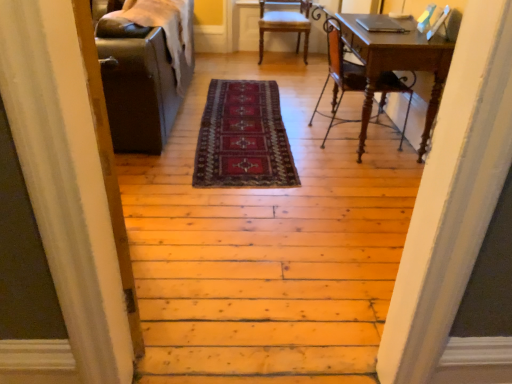
What is the approximate height of wooden chair at right, placed as the second chair when sorted from back to front?

36.46 inches.

The height and width of the screenshot is (384, 512). Identify the location of wooden chair at right, which is the 1th chair from front to back. (339, 71).

Image resolution: width=512 pixels, height=384 pixels. I want to click on wooden desk at right, so click(397, 64).

Measure the distance between point (258, 172) and camera.

Point (258, 172) and camera are 2.66 meters apart.

What are the coordinates of `wooden chair at right, which is the 1th chair from front to back` in the screenshot? It's located at (339, 71).

Could you measure the distance between wooden chair at center, arranged as the 1th chair when viewed from the back, and wooden chair at right, the 1th chair positioned from the bottom?

1.63 meters.

Is wooden chair at center, the first chair in the top-to-bottom sequence, aimed at wooden chair at right, which is the 1th chair from front to back?

Yes, wooden chair at center, the first chair in the top-to-bottom sequence, is facing wooden chair at right, which is the 1th chair from front to back.

Considering the relative positions of wooden chair at center, the second chair when ordered from front to back, and wooden chair at right, which is the 1th chair from front to back, in the image provided, is wooden chair at center, the second chair when ordered from front to back, to the left of wooden chair at right, which is the 1th chair from front to back, from the viewer's perspective?

Yes.

Find the location of a particular element. The width and height of the screenshot is (512, 384). chair that appears below the wooden chair at center, the second chair when ordered from front to back (from the image's perspective) is located at coordinates (339, 71).

Which object is thinner, wooden chair at right, the second chair from the top, or wooden floor at center?

With smaller width is wooden chair at right, the second chair from the top.

Does wooden chair at right, placed as the second chair when sorted from back to front, have a lesser height compared to wooden floor at center?

No.

Is wooden chair at right, which is the 1th chair from front to back, facing towards wooden floor at center?

No.

Between wooden chair at right, the second chair from the top, and wooden desk at right, which one has larger width?

wooden chair at right, the second chair from the top, is wider.

From a real-world perspective, is wooden chair at right, the second chair from the top, positioned over wooden desk at right based on gravity?

Yes, from a real-world perspective, wooden chair at right, the second chair from the top, is above wooden desk at right.

Considering the positions of point (391, 77) and point (428, 138), is point (391, 77) closer or farther from the camera than point (428, 138)?

Point (391, 77) is positioned closer to the camera compared to point (428, 138).

What are the coordinates of `chair that is the 1st one when counting backward from the wooden desk at right` in the screenshot? It's located at (339, 71).

How different are the orientations of wooden chair at center, the second chair when ordered from front to back, and dark red woven rug at center in degrees?

The facing directions of wooden chair at center, the second chair when ordered from front to back, and dark red woven rug at center are 1.57 degrees apart.

Is point (298, 12) positioned before point (249, 89)?

No.

Could you measure the distance between wooden chair at center, arranged as the 1th chair when viewed from the back, and dark red woven rug at center?

wooden chair at center, arranged as the 1th chair when viewed from the back, is 1.90 meters from dark red woven rug at center.

Is wooden chair at center, arranged as the 1th chair when viewed from the back, oriented away from dark red woven rug at center?

No, dark red woven rug at center is not at the back of wooden chair at center, arranged as the 1th chair when viewed from the back.

Considering the sizes of dark red woven rug at center and wooden floor at center in the image, is dark red woven rug at center taller or shorter than wooden floor at center?

In the image, dark red woven rug at center appears to be shorter than wooden floor at center.

The image size is (512, 384). I want to click on stairwell below the dark red woven rug at center (from a real-world perspective), so click(x=268, y=251).

Considering the sizes of objects dark red woven rug at center and wooden floor at center in the image provided, who is bigger, dark red woven rug at center or wooden floor at center?

With larger size is wooden floor at center.

Is dark red woven rug at center looking in the opposite direction of wooden floor at center?

Absolutely, dark red woven rug at center is directed away from wooden floor at center.

Choose the correct answer: Is wooden floor at center inside wooden chair at right, placed as the second chair when sorted from back to front, or outside it?

wooden floor at center is outside wooden chair at right, placed as the second chair when sorted from back to front.

In the scene shown: Considering the positions of objects wooden floor at center and wooden chair at right, the 1th chair positioned from the bottom, in the image provided, who is behind, wooden floor at center or wooden chair at right, the 1th chair positioned from the bottom,?

wooden chair at right, the 1th chair positioned from the bottom, is more distant.

Between wooden floor at center and wooden chair at right, which is the 1th chair from front to back, which one has smaller size?

Smaller between the two is wooden chair at right, which is the 1th chair from front to back.

From the image's perspective, is wooden floor at center beneath wooden chair at right, placed as the second chair when sorted from back to front?

Yes, from the image's perspective, wooden floor at center is beneath wooden chair at right, placed as the second chair when sorted from back to front.

Is wooden chair at right, the 1th chair positioned from the bottom, spatially inside wooden chair at center, the first chair in the top-to-bottom sequence, or outside of it?

wooden chair at right, the 1th chair positioned from the bottom, is not inside wooden chair at center, the first chair in the top-to-bottom sequence, it's outside.

What's the angular difference between wooden chair at right, which is the 1th chair from front to back, and wooden chair at center, arranged as the 1th chair when viewed from the back,'s facing directions?

93 degrees separate the facing orientations of wooden chair at right, which is the 1th chair from front to back, and wooden chair at center, arranged as the 1th chair when viewed from the back.

You are a GUI agent. You are given a task and a screenshot of the screen. Output one action in this format:
    pyautogui.click(x=<x>, y=<y>)
    Task: Click on the chair in front of the wooden chair at center, the first chair in the top-to-bottom sequence
    The image size is (512, 384).
    Given the screenshot: What is the action you would take?
    pyautogui.click(x=339, y=71)

Between point (382, 107) and point (281, 28), which one is positioned behind?

The point (281, 28) is more distant.

Find the location of a particular element. chair above the wooden chair at right, placed as the second chair when sorted from back to front (from the image's perspective) is located at coordinates (285, 23).

The height and width of the screenshot is (384, 512). I want to click on stairwell below the wooden chair at right, the second chair from the top (from a real-world perspective), so click(x=268, y=251).

From the picture: When comparing their distances from wooden desk at right, does wooden floor at center or dark red woven rug at center seem further?

dark red woven rug at center.

Estimate the real-world distances between objects in this image. Which object is closer to wooden chair at right, the 1th chair positioned from the bottom, wooden desk at right or wooden floor at center?

The object closer to wooden chair at right, the 1th chair positioned from the bottom, is wooden desk at right.

Based on their spatial positions, is wooden chair at center, which appears as the 2th chair when ordered from the bottom, or wooden floor at center closer to wooden desk at right?

wooden floor at center is positioned closer to the anchor wooden desk at right.

From the image, which object appears to be farther from wooden desk at right, wooden floor at center or wooden chair at right, the second chair from the top?

wooden floor at center.

Estimate the real-world distances between objects in this image. Which object is closer to wooden desk at right, wooden chair at right, which is the 1th chair from front to back, or wooden chair at center, which appears as the 2th chair when ordered from the bottom?

wooden chair at right, which is the 1th chair from front to back, is closer to wooden desk at right.

Estimate the real-world distances between objects in this image. Which object is closer to wooden chair at center, which appears as the 2th chair when ordered from the bottom, wooden floor at center or wooden desk at right?

The object closer to wooden chair at center, which appears as the 2th chair when ordered from the bottom, is wooden desk at right.

Considering their positions, is wooden chair at right, the 1th chair positioned from the bottom, positioned further to dark red woven rug at center than wooden desk at right?

wooden desk at right lies further to dark red woven rug at center than the other object.

Considering their positions, is dark red woven rug at center positioned closer to wooden chair at center, which appears as the 2th chair when ordered from the bottom, than wooden floor at center?

dark red woven rug at center.

At what (x,y) coordinates should I click in order to perform the action: click on computer desk located between wooden floor at center and wooden chair at right, placed as the second chair when sorted from back to front, in the depth direction. Please return your answer as a coordinate pair (x, y). This screenshot has height=384, width=512. Looking at the image, I should click on (397, 64).

At what (x,y) coordinates should I click in order to perform the action: click on chair between wooden floor at center and wooden chair at center, arranged as the 1th chair when viewed from the back, in the front-back direction. Please return your answer as a coordinate pair (x, y). The width and height of the screenshot is (512, 384). Looking at the image, I should click on (339, 71).

Find the location of a particular element. This screenshot has height=384, width=512. chair between dark red woven rug at center and wooden chair at center, which appears as the 2th chair when ordered from the bottom, from front to back is located at coordinates (339, 71).

Find the location of a particular element. This screenshot has height=384, width=512. chair between wooden desk at right and wooden chair at center, arranged as the 1th chair when viewed from the back, in the front-back direction is located at coordinates (339, 71).